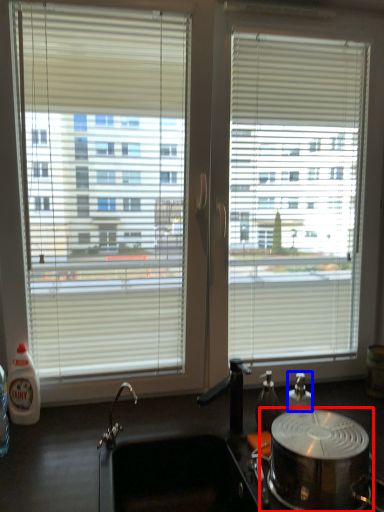
Question: Among these objects, which one is farthest to the camera, appliance (highlighted by a red box) or bottle (highlighted by a blue box)?

Choices:
 (A) appliance
 (B) bottle

Answer: (B)